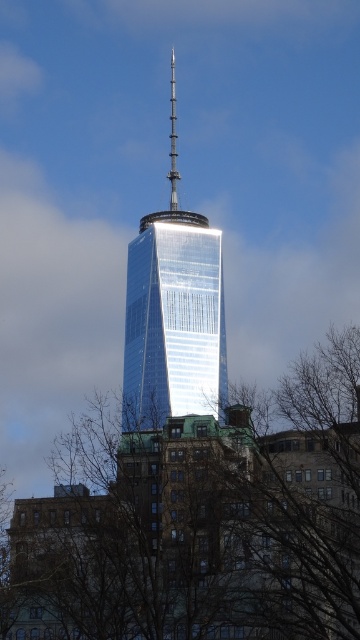
Question: Does brown leafless branches at lower center appear on the right side of polished silver spire at center?

Choices:
 (A) yes
 (B) no

Answer: (A)

Question: Among these points, which one is nearest to the camera?

Choices:
 (A) (257, 554)
 (B) (219, 381)

Answer: (A)

Question: Which point is closer to the camera?

Choices:
 (A) polished silver spire at center
 (B) brown leafless branches at lower center

Answer: (B)

Question: Which point is farther to the camera?

Choices:
 (A) brown leafless branches at lower center
 (B) polished silver spire at center

Answer: (B)

Question: Is brown leafless branches at lower center smaller than shiny glass skyscraper at center?

Choices:
 (A) yes
 (B) no

Answer: (B)

Question: Observing the image, what is the correct spatial positioning of brown leafless branches at lower center in reference to shiny glass skyscraper at center?

Choices:
 (A) above
 (B) below

Answer: (B)